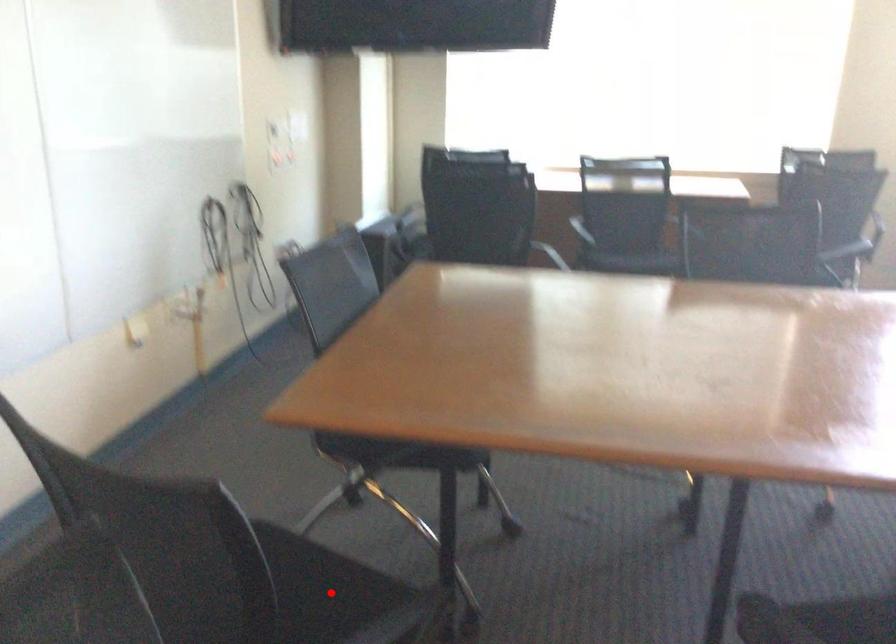
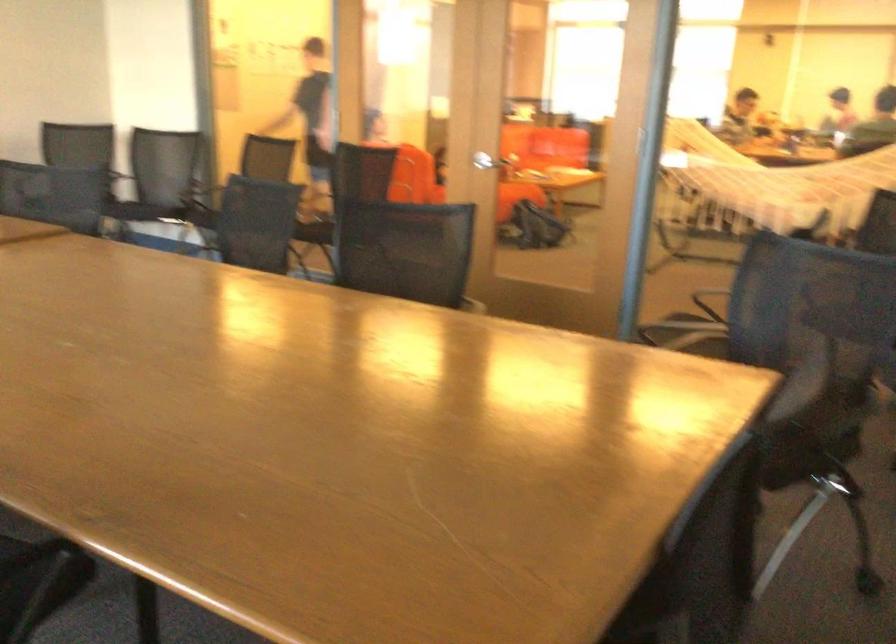
Question: I am providing you with two images of the same scene from different viewpoints. A red point is marked on the first image. At the location where the point appears in image 1, is it still visible in image 2?

Choices:
 (A) Yes
 (B) No

Answer: (B)